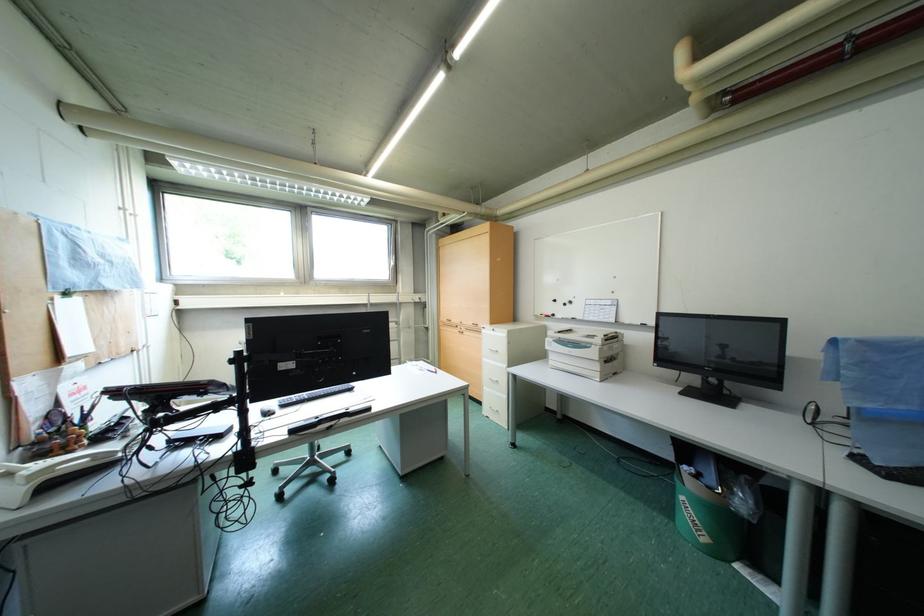
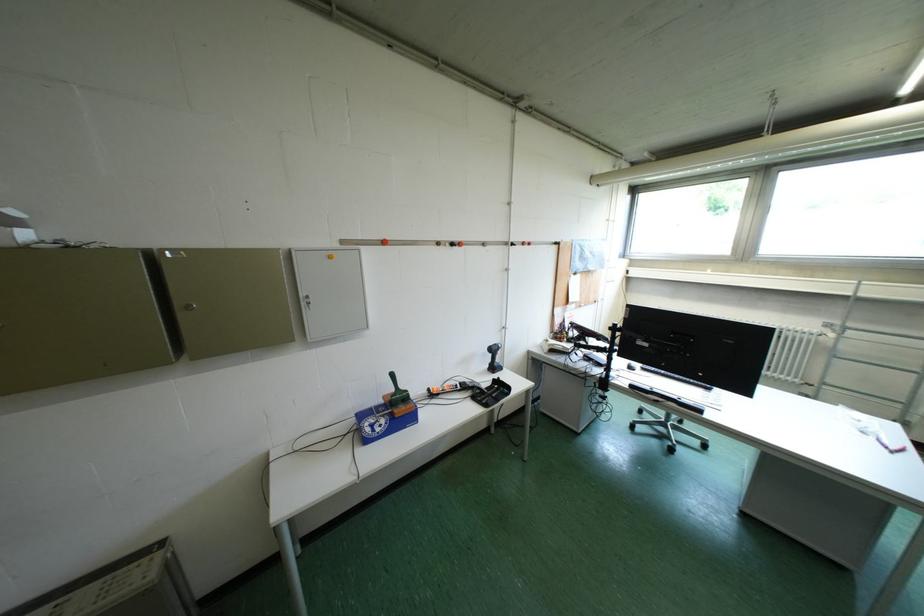
Question: The images are taken continuously from a first-person perspective. In which direction is your viewpoint rotating?

Choices:
 (A) Left
 (B) Right
 (C) Up
 (D) Down

Answer: (A)